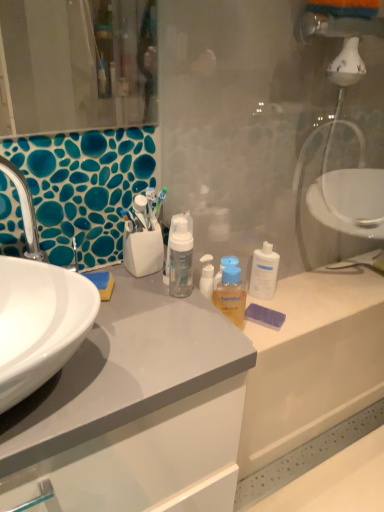
Question: In terms of height, does white glossy sink at left look taller or shorter compared to translucent orange liquid at center?

Choices:
 (A) tall
 (B) short

Answer: (A)

Question: Considering the positions of point (51, 297) and point (241, 320), is point (51, 297) closer or farther from the camera than point (241, 320)?

Choices:
 (A) farther
 (B) closer

Answer: (B)

Question: Which object is positioned closest to the white glossy sink at left?

Choices:
 (A) transparent plastic bottle at center
 (B) transparent plastic glass door at center
 (C) translucent orange liquid at center

Answer: (C)

Question: Estimate the real-world distances between objects in this image. Which object is farther from the white glossy sink at left?

Choices:
 (A) transparent plastic glass door at center
 (B) transparent plastic bottle at center
 (C) translucent orange liquid at center

Answer: (B)